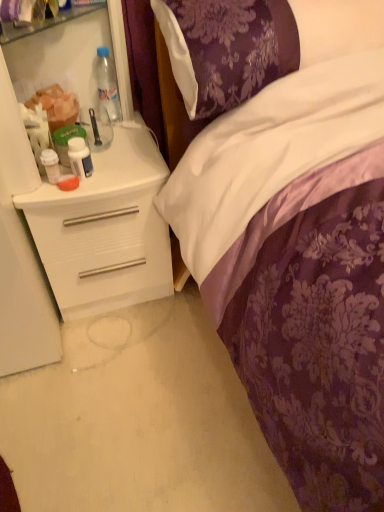
Question: Should I look upward or downward to see white plastic desk at left?

Choices:
 (A) up
 (B) down

Answer: (A)

Question: Could you tell me if purple satin pillow at upper center is facing translucent plastic cup at left?

Choices:
 (A) no
 (B) yes

Answer: (A)

Question: Is purple satin pillow at upper center outside of translucent plastic cup at left?

Choices:
 (A) no
 (B) yes

Answer: (B)

Question: Is purple satin pillow at upper center closer to the viewer compared to translucent plastic cup at left?

Choices:
 (A) no
 (B) yes

Answer: (B)

Question: Is purple satin pillow at upper center far from translucent plastic cup at left?

Choices:
 (A) no
 (B) yes

Answer: (A)

Question: Considering the relative positions of purple satin pillow at upper center and translucent plastic cup at left in the image provided, is purple satin pillow at upper center behind translucent plastic cup at left?

Choices:
 (A) no
 (B) yes

Answer: (A)

Question: Is purple satin pillow at upper center turned away from translucent plastic cup at left?

Choices:
 (A) no
 (B) yes

Answer: (A)

Question: Is clear plastic bottle at upper left, which is counted as the first bottle, starting from the top, completely or partially outside of white plastic desk at left?

Choices:
 (A) yes
 (B) no

Answer: (A)

Question: Considering the relative sizes of clear plastic bottle at upper left, which is counted as the first bottle, starting from the top, and white plastic desk at left in the image provided, is clear plastic bottle at upper left, which is counted as the first bottle, starting from the top, shorter than white plastic desk at left?

Choices:
 (A) yes
 (B) no

Answer: (A)

Question: From the image's perspective, is clear plastic bottle at upper left, the 1th bottle viewed from the back, located beneath white plastic desk at left?

Choices:
 (A) no
 (B) yes

Answer: (A)

Question: Is clear plastic bottle at upper left, the first bottle positioned from the right, far away from white plastic desk at left?

Choices:
 (A) yes
 (B) no

Answer: (B)

Question: Does clear plastic bottle at upper left, the 3th bottle from the left, come behind white plastic desk at left?

Choices:
 (A) yes
 (B) no

Answer: (A)

Question: Can you confirm if clear plastic bottle at upper left, the 3th bottle from the left, is bigger than white plastic desk at left?

Choices:
 (A) yes
 (B) no

Answer: (B)

Question: Is white plastic cup at left, the 3th bottle viewed from the right, at the right side of white glossy pill bottle at left, the second bottle in the front-to-back sequence?

Choices:
 (A) yes
 (B) no

Answer: (B)